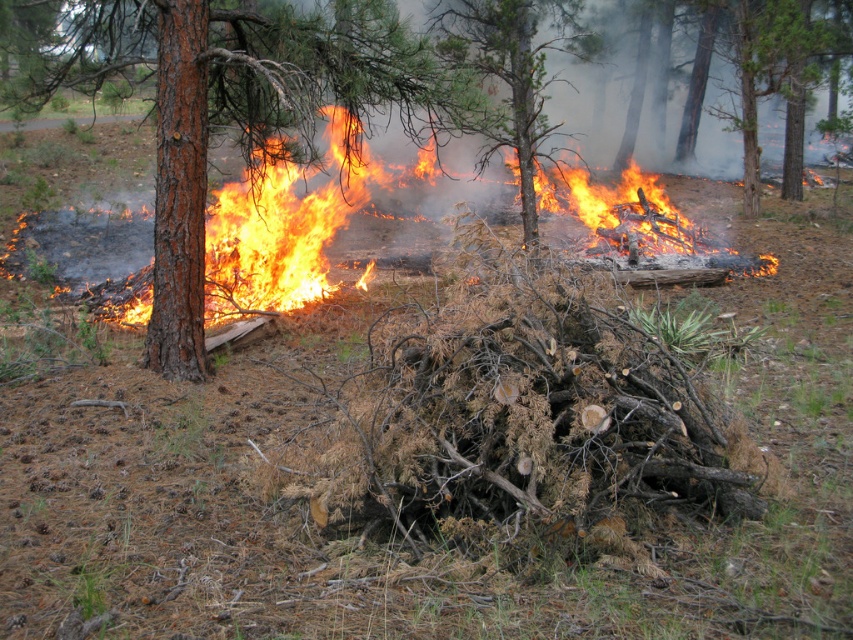
You are a firefighter assessing the fire scene. You notice the flaming wood at center and the charred wood tree at center. Which object is wider in terms of physical size?

The flaming wood at center is wider than the charred wood tree at center according to the description provided.

You are a firefighter assessing the fire scene. You notice a brown rough bark tree at left and a charred wood tree at center. Which tree is closer to you?

The brown rough bark tree at left is closer to you because it is in front of the charred wood tree at center.

You are a firefighter assessing the fire scene. You notice the brown rough bark tree at left and the flaming wood at center. Based on their positions, which object is closer to the ground?

The flaming wood at center is closer to the ground because the brown rough bark tree at left is located above it.